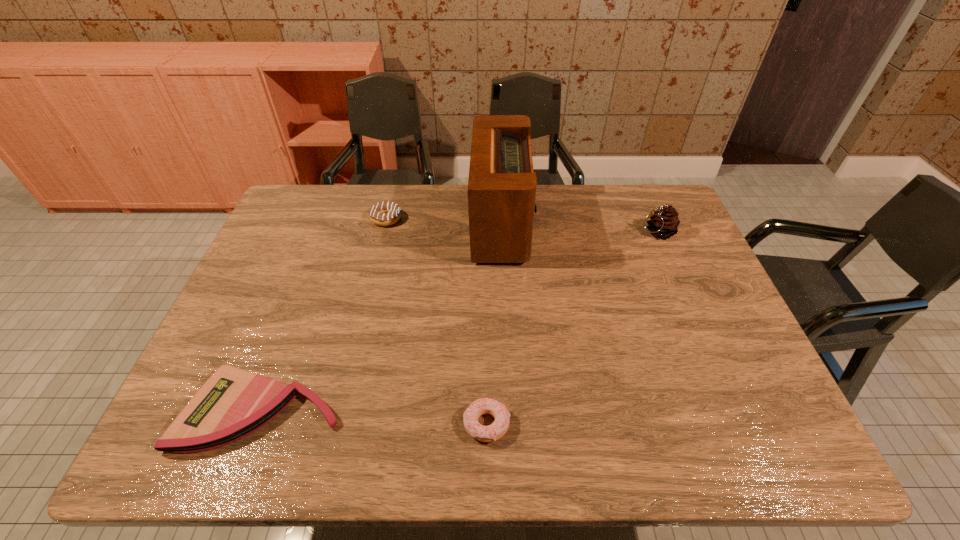
This screenshot has width=960, height=540. I want to click on blank space located 0.050m on the back of the farther doughnut, so click(x=391, y=200).

Find the location of `vacant position located on the back of the right doughnut`. vacant position located on the back of the right doughnut is located at coordinates (486, 309).

Image resolution: width=960 pixels, height=540 pixels. Find the location of `free space located 0.270m on the back of the wristlet`. free space located 0.270m on the back of the wristlet is located at coordinates (306, 288).

What are the coordinates of `radio receiver situated at the far edge` in the screenshot? It's located at tap(502, 185).

Find the location of a particular element. The height and width of the screenshot is (540, 960). pinecone that is at the far edge is located at coordinates (664, 223).

Find the location of a particular element. doughnut that is at the far edge is located at coordinates (385, 213).

The image size is (960, 540). In order to click on doughnut present at the near edge in this screenshot , I will do `click(499, 427)`.

Identify the location of wristlet present at the near edge. The image size is (960, 540). (233, 403).

Locate an element on the screen. The height and width of the screenshot is (540, 960). object at the left edge is located at coordinates (233, 403).

The height and width of the screenshot is (540, 960). In order to click on object located at the right edge in this screenshot , I will do `click(664, 223)`.